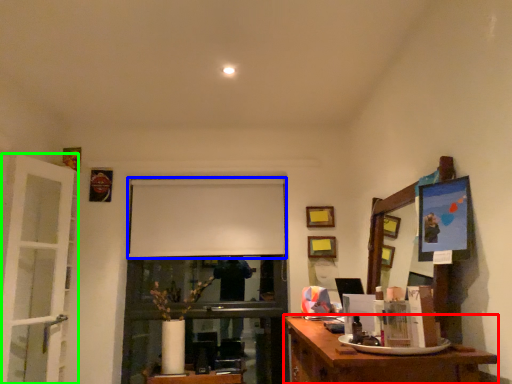
Question: Which is farther away from desk (highlighted by a red box)? projection screen (highlighted by a blue box) or door (highlighted by a green box)?

Choices:
 (A) projection screen
 (B) door

Answer: (B)